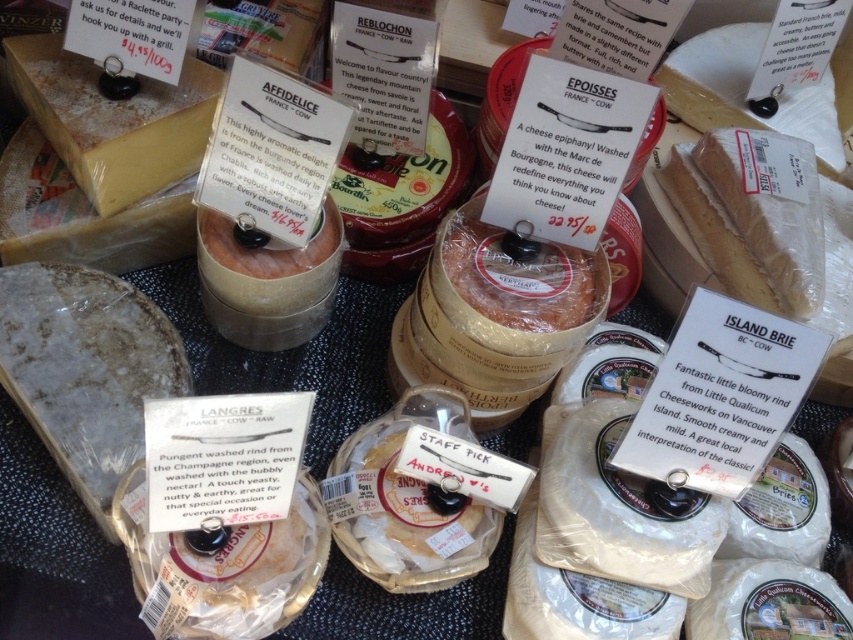
From the picture: You are a customer at the cheese shop and want to place an order for both the yellowish hard cheese at upper left and the white crumbly cheese at upper right. The cashier asks you to specify their positions relative to each other. How far apart are they?

The yellowish hard cheese at upper left and the white crumbly cheese at upper right are 39.13 inches apart.

You are standing at the cheese counter and want to pick up the Affid?l?ice cheese. The cheese shop has a rule that you must not lean more than 3 feet from your position to reach any item. Can you safely reach the cheese at point (194, 93) without violating the rule?

The point (194, 93) is 3.30 feet away from the camera, which is slightly beyond the 3 feet limit. Therefore, you cannot safely reach the cheese at that point without violating the shop rule.

You are a customer at the cheese shop and want to pick up the yellowish hard cheese at upper left. If your hand can reach up to 30 inches, can you comfortably reach it?

The yellowish hard cheese at upper left is 36.05 inches away from the viewer, which is beyond the 30 inches reach of your hand. You may need to move closer or ask for assistance to reach it.